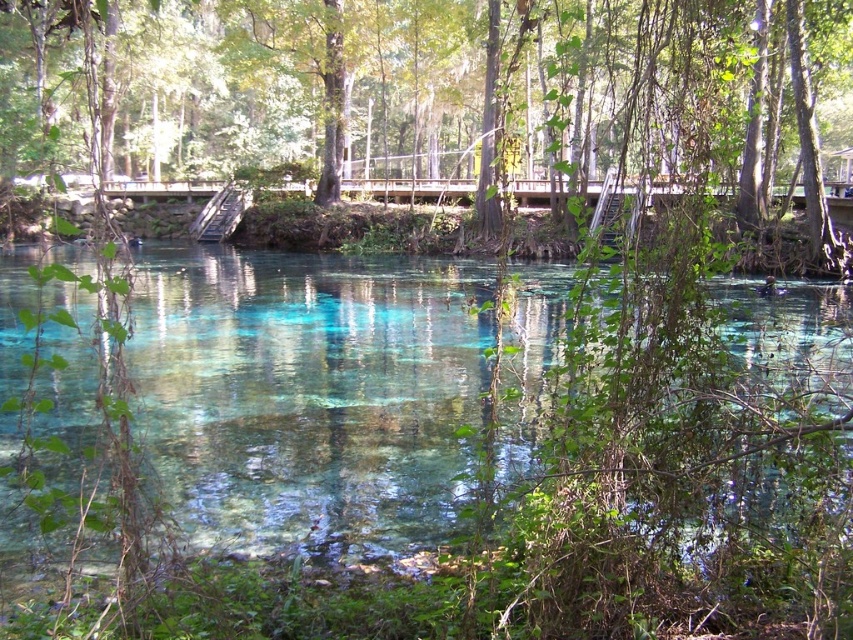
You are standing on the wooden bridge and see the green leafy tree at center and the clear glassy water at center. Which object is positioned to the left?

The green leafy tree at center is to the left of the clear glassy water at center.

You are standing on the wooden bridge and want to take a photo of both the green leafy tree at center and the clear glassy water at center. Which object should you focus on first if you want to ensure both are in the frame?

You should focus on the green leafy tree at center first because it is larger in size than the clear glassy water at center, so it will dominate the frame and help ensure both are visible.